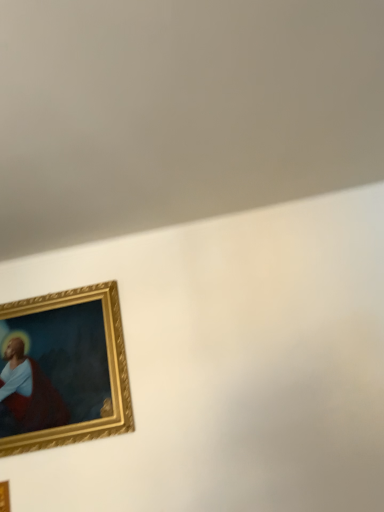
What are the coordinates of `gold wooden picture frame at lower left, the first picture frame in the bottom-to-top sequence` in the screenshot? It's located at (4, 497).

Describe the element at coordinates (4, 497) in the screenshot. I see `gold wooden picture frame at lower left, positioned as the second picture frame in back-to-front order` at that location.

The height and width of the screenshot is (512, 384). What do you see at coordinates (63, 370) in the screenshot?
I see `gold/gilded picture frame at lower left, the 2th picture frame positioned from the front` at bounding box center [63, 370].

The width and height of the screenshot is (384, 512). I want to click on gold/gilded picture frame at lower left, placed as the 1th picture frame when sorted from back to front, so click(x=63, y=370).

Measure the distance between gold/gilded picture frame at lower left, the 2th picture frame positioned from the front, and camera.

The distance of gold/gilded picture frame at lower left, the 2th picture frame positioned from the front, from camera is 1.67 meters.

Where is `gold wooden picture frame at lower left, positioned as the second picture frame in back-to-front order`? The height and width of the screenshot is (512, 384). gold wooden picture frame at lower left, positioned as the second picture frame in back-to-front order is located at coordinates (4, 497).

Which object is positioned more to the right, gold/gilded picture frame at lower left, placed as the 1th picture frame when sorted from back to front, or gold wooden picture frame at lower left, the first picture frame in the bottom-to-top sequence?

From the viewer's perspective, gold/gilded picture frame at lower left, placed as the 1th picture frame when sorted from back to front, appears more on the right side.

Relative to gold wooden picture frame at lower left, positioned as the second picture frame in back-to-front order, is gold/gilded picture frame at lower left, the 2th picture frame positioned from the front, in front or behind?

gold/gilded picture frame at lower left, the 2th picture frame positioned from the front, is behind gold wooden picture frame at lower left, positioned as the second picture frame in back-to-front order.

Is point (106, 373) positioned in front of point (9, 510)?

No, it is behind (9, 510).

From the image's perspective, would you say gold/gilded picture frame at lower left, marked as the second picture frame in a bottom-to-top arrangement, is shown under gold wooden picture frame at lower left, which ranks as the 2th picture frame in top-to-bottom order?

Incorrect, from the image's perspective, gold/gilded picture frame at lower left, marked as the second picture frame in a bottom-to-top arrangement, is higher than gold wooden picture frame at lower left, which ranks as the 2th picture frame in top-to-bottom order.

From a real-world perspective, which is physically above, gold/gilded picture frame at lower left, marked as the second picture frame in a bottom-to-top arrangement, or gold wooden picture frame at lower left, the first picture frame in the bottom-to-top sequence?

In real-world perspective, gold/gilded picture frame at lower left, marked as the second picture frame in a bottom-to-top arrangement, is above.

Does gold/gilded picture frame at lower left, which is counted as the first picture frame, starting from the top, have a greater width compared to gold wooden picture frame at lower left, positioned as the second picture frame in back-to-front order?

Correct, the width of gold/gilded picture frame at lower left, which is counted as the first picture frame, starting from the top, exceeds that of gold wooden picture frame at lower left, positioned as the second picture frame in back-to-front order.

Considering the sizes of objects gold/gilded picture frame at lower left, marked as the second picture frame in a bottom-to-top arrangement, and gold wooden picture frame at lower left, positioned as the first picture frame in front-to-back order, in the image provided, who is shorter, gold/gilded picture frame at lower left, marked as the second picture frame in a bottom-to-top arrangement, or gold wooden picture frame at lower left, positioned as the first picture frame in front-to-back order,?

gold wooden picture frame at lower left, positioned as the first picture frame in front-to-back order, is shorter.

Which of these two, gold/gilded picture frame at lower left, which is counted as the first picture frame, starting from the top, or gold wooden picture frame at lower left, positioned as the second picture frame in back-to-front order, is smaller?

Smaller between the two is gold wooden picture frame at lower left, positioned as the second picture frame in back-to-front order.

Is gold/gilded picture frame at lower left, which is counted as the first picture frame, starting from the top, surrounding gold wooden picture frame at lower left, positioned as the second picture frame in back-to-front order?

No, gold wooden picture frame at lower left, positioned as the second picture frame in back-to-front order, is not surrounded by gold/gilded picture frame at lower left, which is counted as the first picture frame, starting from the top.

Is gold/gilded picture frame at lower left, the 2th picture frame positioned from the front, directly adjacent to gold wooden picture frame at lower left, positioned as the first picture frame in front-to-back order?

gold/gilded picture frame at lower left, the 2th picture frame positioned from the front, and gold wooden picture frame at lower left, positioned as the first picture frame in front-to-back order, are clearly separated.

Is gold/gilded picture frame at lower left, the 2th picture frame positioned from the front, oriented towards gold wooden picture frame at lower left, positioned as the first picture frame in front-to-back order?

No, gold/gilded picture frame at lower left, the 2th picture frame positioned from the front, does not turn towards gold wooden picture frame at lower left, positioned as the first picture frame in front-to-back order.

Can you tell me how much gold/gilded picture frame at lower left, placed as the 1th picture frame when sorted from back to front, and gold wooden picture frame at lower left, which ranks as the 2th picture frame in top-to-bottom order, differ in facing direction?

The angular difference between gold/gilded picture frame at lower left, placed as the 1th picture frame when sorted from back to front, and gold wooden picture frame at lower left, which ranks as the 2th picture frame in top-to-bottom order, is 0.954 degrees.

Where is `picture frame on the left of gold/gilded picture frame at lower left, placed as the 1th picture frame when sorted from back to front`? The height and width of the screenshot is (512, 384). picture frame on the left of gold/gilded picture frame at lower left, placed as the 1th picture frame when sorted from back to front is located at coordinates (4, 497).

Is gold wooden picture frame at lower left, which ranks as the 2th picture frame in top-to-bottom order, at the left side of gold/gilded picture frame at lower left, marked as the second picture frame in a bottom-to-top arrangement?

Yes, gold wooden picture frame at lower left, which ranks as the 2th picture frame in top-to-bottom order, is to the left of gold/gilded picture frame at lower left, marked as the second picture frame in a bottom-to-top arrangement.

Is the depth of gold wooden picture frame at lower left, which ranks as the 2th picture frame in top-to-bottom order, less than that of gold/gilded picture frame at lower left, the 2th picture frame positioned from the front?

Yes, gold wooden picture frame at lower left, which ranks as the 2th picture frame in top-to-bottom order, is in front of gold/gilded picture frame at lower left, the 2th picture frame positioned from the front.

Is point (8, 484) closer or farther from the camera than point (70, 309)?

Point (8, 484).

From the image's perspective, is gold wooden picture frame at lower left, which ranks as the 2th picture frame in top-to-bottom order, located beneath gold/gilded picture frame at lower left, the 2th picture frame positioned from the front?

Indeed, from the image's perspective, gold wooden picture frame at lower left, which ranks as the 2th picture frame in top-to-bottom order, is shown beneath gold/gilded picture frame at lower left, the 2th picture frame positioned from the front.

From a real-world perspective, does gold wooden picture frame at lower left, which ranks as the 2th picture frame in top-to-bottom order, sit lower than gold/gilded picture frame at lower left, the 2th picture frame positioned from the front?

Yes, from a real-world perspective, gold wooden picture frame at lower left, which ranks as the 2th picture frame in top-to-bottom order, is beneath gold/gilded picture frame at lower left, the 2th picture frame positioned from the front.

From the picture: Can you confirm if gold wooden picture frame at lower left, which ranks as the 2th picture frame in top-to-bottom order, is wider than gold/gilded picture frame at lower left, placed as the 1th picture frame when sorted from back to front?

No.

Between gold wooden picture frame at lower left, the first picture frame in the bottom-to-top sequence, and gold/gilded picture frame at lower left, the 2th picture frame positioned from the front, which one has more height?

gold/gilded picture frame at lower left, the 2th picture frame positioned from the front.

Who is smaller, gold wooden picture frame at lower left, the first picture frame in the bottom-to-top sequence, or gold/gilded picture frame at lower left, which is counted as the first picture frame, starting from the top?

gold wooden picture frame at lower left, the first picture frame in the bottom-to-top sequence, is smaller.

Can we say gold wooden picture frame at lower left, positioned as the second picture frame in back-to-front order, lies outside gold/gilded picture frame at lower left, the 2th picture frame positioned from the front?

Yes, gold wooden picture frame at lower left, positioned as the second picture frame in back-to-front order, is not within gold/gilded picture frame at lower left, the 2th picture frame positioned from the front.

Are gold wooden picture frame at lower left, positioned as the second picture frame in back-to-front order, and gold/gilded picture frame at lower left, which is counted as the first picture frame, starting from the top, far apart?

No, gold wooden picture frame at lower left, positioned as the second picture frame in back-to-front order, is not far away from gold/gilded picture frame at lower left, which is counted as the first picture frame, starting from the top.

Is gold wooden picture frame at lower left, positioned as the second picture frame in back-to-front order, oriented towards gold/gilded picture frame at lower left, the 2th picture frame positioned from the front?

No, gold wooden picture frame at lower left, positioned as the second picture frame in back-to-front order, is not turned towards gold/gilded picture frame at lower left, the 2th picture frame positioned from the front.

This screenshot has height=512, width=384. What are the coordinates of `picture frame lying on the right of gold wooden picture frame at lower left, the first picture frame in the bottom-to-top sequence` in the screenshot? It's located at pos(63,370).

The height and width of the screenshot is (512, 384). What are the coordinates of `picture frame that appears on the left of gold/gilded picture frame at lower left, which is counted as the first picture frame, starting from the top` in the screenshot? It's located at (4, 497).

The image size is (384, 512). Find the location of `picture frame that appears above the gold wooden picture frame at lower left, positioned as the first picture frame in front-to-back order (from the image's perspective)`. picture frame that appears above the gold wooden picture frame at lower left, positioned as the first picture frame in front-to-back order (from the image's perspective) is located at coordinates (63, 370).